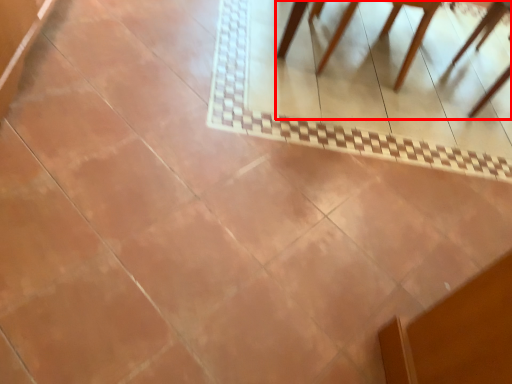
Question: Observing the image, what is the correct spatial positioning of furniture (annotated by the red box) in reference to chair?

Choices:
 (A) right
 (B) left

Answer: (B)